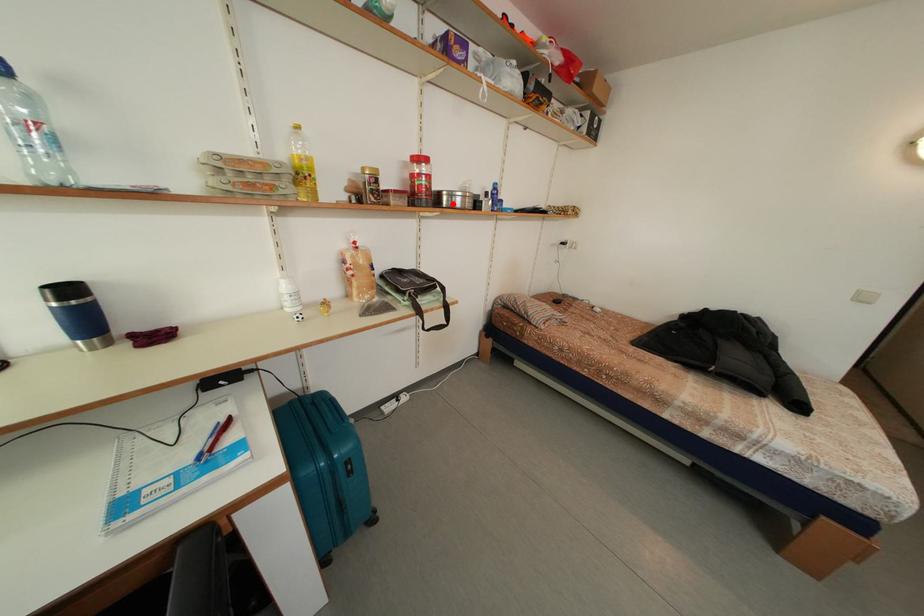
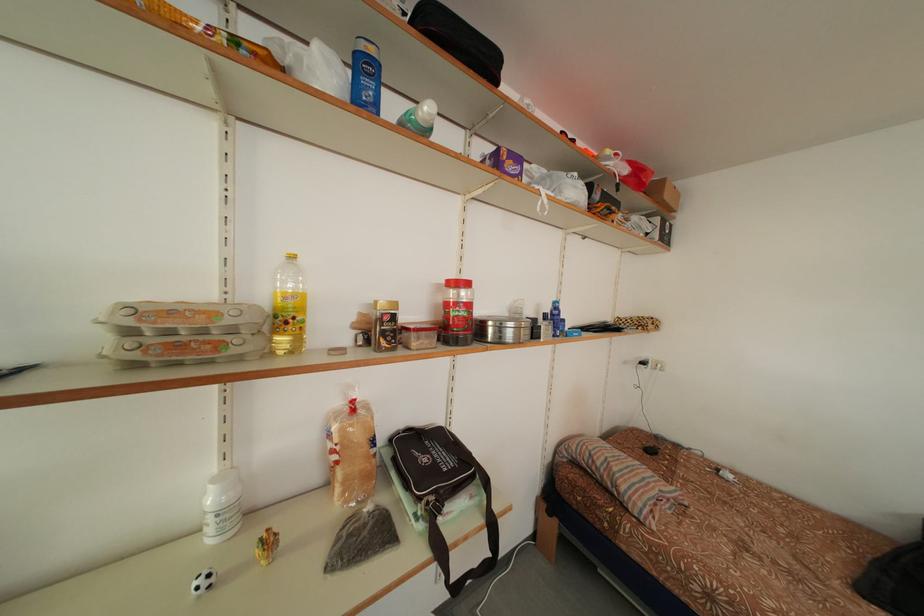
Where in the second image is the point corresponding to the highlighted location from the first image?

(499, 334)